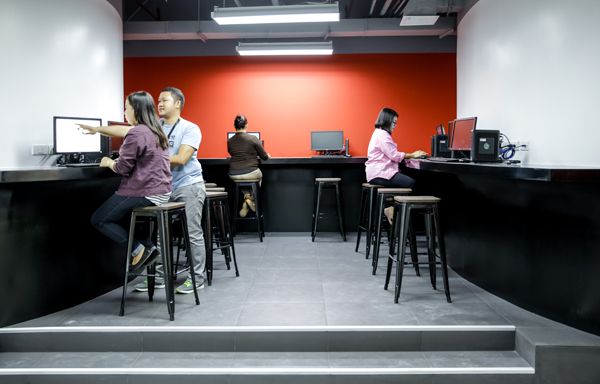
At what (x,y) coordinates should I click in order to perform the action: click on chairs/stools. Please return your answer as a coordinate pair (x, y). Image resolution: width=600 pixels, height=384 pixels. Looking at the image, I should click on (162, 213), (250, 176), (222, 193), (216, 187), (328, 182), (364, 186), (380, 189), (409, 200).